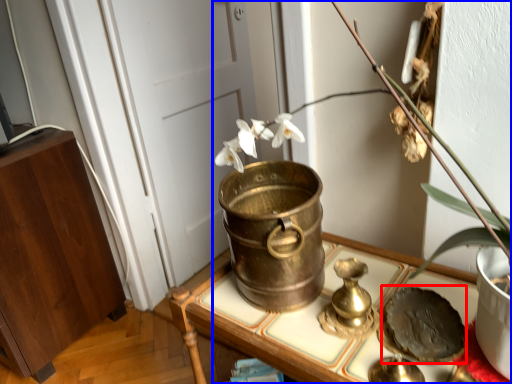
Question: Which object is further to the camera taking this photo, food (highlighted by a red box) or houseplant (highlighted by a blue box)?

Choices:
 (A) food
 (B) houseplant

Answer: (A)